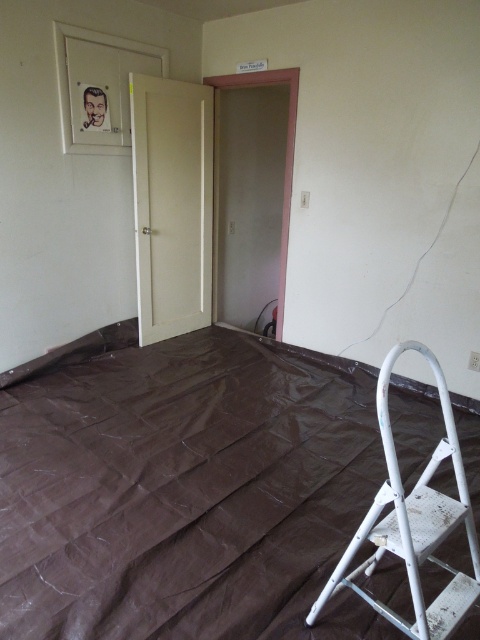
Question: Does brown plastic sheet at lower right appear over white matte step ladder at lower right?

Choices:
 (A) no
 (B) yes

Answer: (B)

Question: Does brown plastic sheet at lower right come in front of white matte step ladder at lower right?

Choices:
 (A) no
 (B) yes

Answer: (A)

Question: Is brown plastic sheet at lower right above white matte step ladder at lower right?

Choices:
 (A) no
 (B) yes

Answer: (B)

Question: Which of the following is the closest to the observer?

Choices:
 (A) white matte step ladder at lower right
 (B) brown plastic sheet at lower right

Answer: (A)